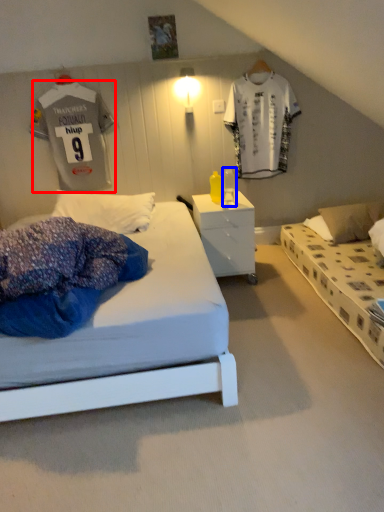
Question: Which point is further to the camera, t shirt (highlighted by a red box) or table lamp (highlighted by a blue box)?

Choices:
 (A) t shirt
 (B) table lamp

Answer: (A)